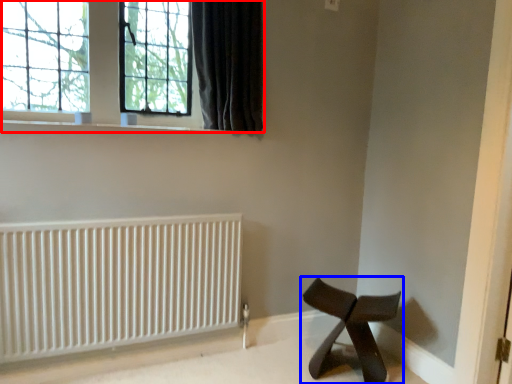
Question: Which point is closer to the camera, window (highlighted by a red box) or furniture (highlighted by a blue box)?

Choices:
 (A) window
 (B) furniture

Answer: (B)